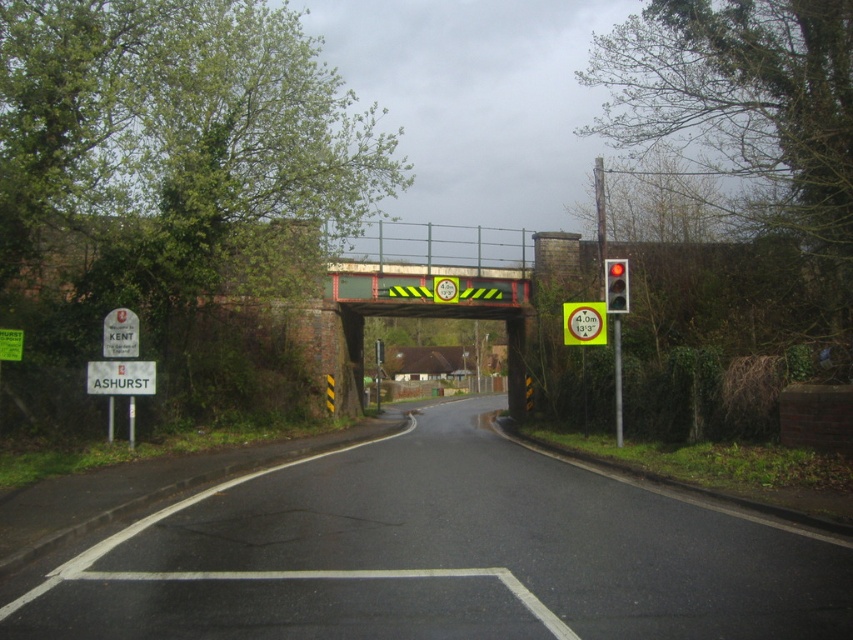
From the picture: Which of these two, white plastic sign at lower left or metallic rectangular sign at left, stands taller?

metallic rectangular sign at left is taller.

Does white plastic sign at lower left appear on the left side of metallic rectangular sign at left?

Yes, white plastic sign at lower left is to the left of metallic rectangular sign at left.

At what (x,y) coordinates should I click in order to perform the action: click on white plastic sign at lower left. Please return your answer as a coordinate pair (x, y). Image resolution: width=853 pixels, height=640 pixels. Looking at the image, I should click on (120, 378).

Does yellow reflective circle at upper center appear on the left side of metallic rectangular sign at left?

In fact, yellow reflective circle at upper center is to the right of metallic rectangular sign at left.

Locate an element on the screen. The image size is (853, 640). yellow reflective circle at upper center is located at coordinates (584, 323).

Locate an element on the screen. Image resolution: width=853 pixels, height=640 pixels. yellow reflective circle at upper center is located at coordinates (584, 323).

This screenshot has height=640, width=853. Describe the element at coordinates (584, 323) in the screenshot. I see `yellow reflective circle at upper center` at that location.

Does yellow reflective circle at upper center appear over red glass traffic light at right?

Actually, yellow reflective circle at upper center is below red glass traffic light at right.

Find the location of a particular element. The width and height of the screenshot is (853, 640). yellow reflective circle at upper center is located at coordinates (584, 323).

This screenshot has height=640, width=853. I want to click on yellow reflective circle at upper center, so 584,323.